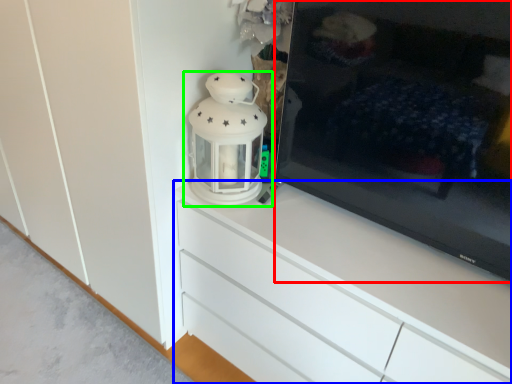
Question: Based on their relative distances, which object is farther from television (highlighted by a red box)? Choose from chest of drawers (highlighted by a blue box) and lantern (highlighted by a green box).

Choices:
 (A) chest of drawers
 (B) lantern

Answer: (B)